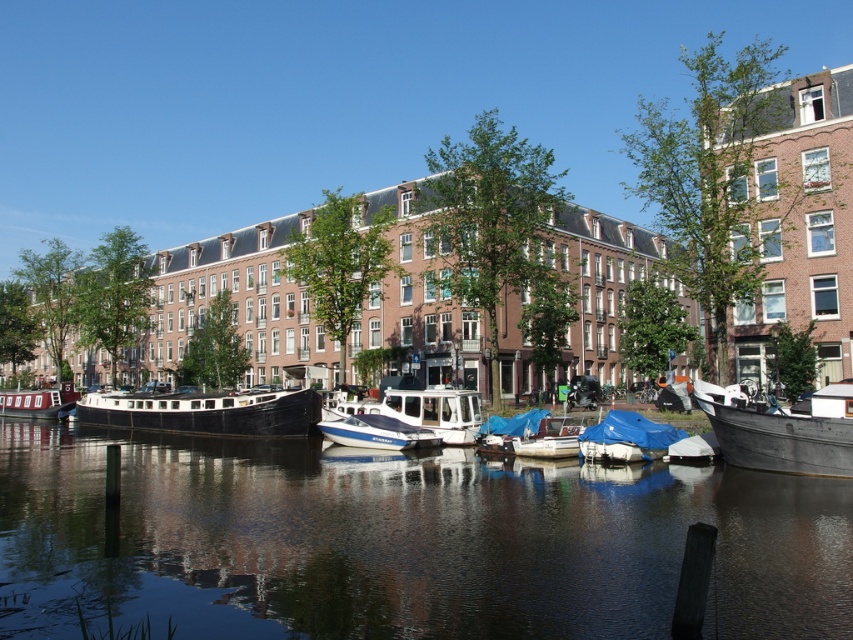
Question: Which point is farther to the camera?

Choices:
 (A) white glossy boat at center
 (B) blue glossy boat at center

Answer: (A)

Question: Is rusty metal boat at right further to the viewer compared to blue tarpaulin boat at center?

Choices:
 (A) no
 (B) yes

Answer: (A)

Question: Based on their relative distances, which object is farther from the white glossy boat at center?

Choices:
 (A) black matte boat at center
 (B) rusty metal boat at right
 (C) blue glossy boat at center
 (D) matte black boat at left

Answer: (D)

Question: Can you confirm if rusty metal boat at right is thinner than black matte boat at center?

Choices:
 (A) yes
 (B) no

Answer: (A)

Question: Which is nearer to the smooth dark water at center?

Choices:
 (A) matte black boat at left
 (B) blue glossy boat at center

Answer: (B)

Question: Can you confirm if rusty metal boat at right is wider than white glossy boat at center?

Choices:
 (A) no
 (B) yes

Answer: (A)